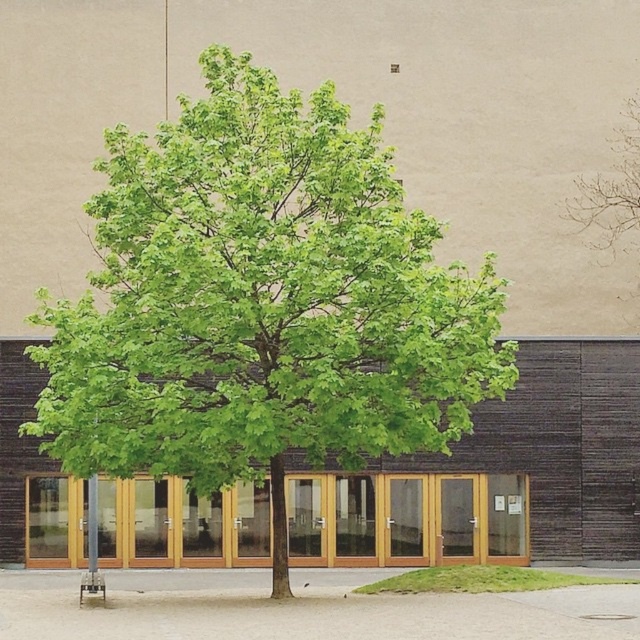
Is green leafy tree at center to the right of green leafy tree at upper center from the viewer's perspective?

No, green leafy tree at center is not to the right of green leafy tree at upper center.

Does green leafy tree at center have a greater width compared to green leafy tree at upper center?

No.

Between point (202, 131) and point (627, 115), which one is positioned in front?

Point (202, 131) is in front.

Locate an element on the screen. green leafy tree at center is located at coordinates (260, 304).